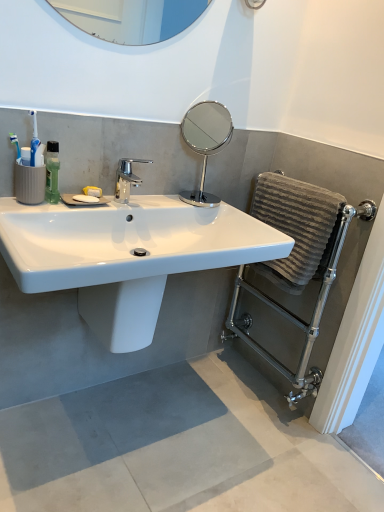
Image resolution: width=384 pixels, height=512 pixels. What are the coordinates of `free point behind polished chrome tap at center` in the screenshot? It's located at (156, 196).